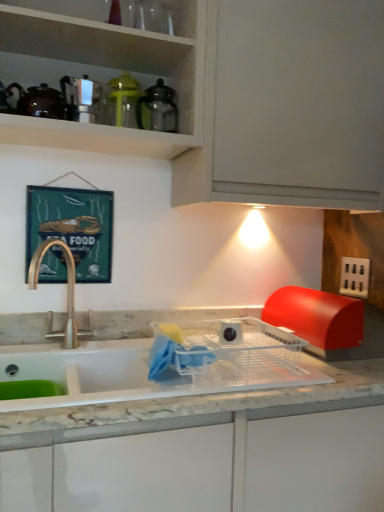
Question: In the image, is satin nickel soap dispenser at upper left, the 1th appliance when ordered from left to right, positioned in front of or behind white glossy sink at center?

Choices:
 (A) behind
 (B) front

Answer: (A)

Question: From the image's perspective, is satin nickel soap dispenser at upper left, the 3th appliance in the right-to-left sequence, located above or below white glossy sink at center?

Choices:
 (A) below
 (B) above

Answer: (B)

Question: Considering the real-world distances, which object is closest to the white glossy sink at center?

Choices:
 (A) translucent yellow pitcher at upper center, the second appliance positioned from the right
 (B) black plastic electric outlet at right
 (C) white matte cabinet at upper center
 (D) satin nickel soap dispenser at upper left, the 3th appliance in the right-to-left sequence
 (E) matte brown teapot at upper left

Answer: (C)

Question: Which object is positioned farthest from the satin nickel soap dispenser at upper left, the 1th appliance when ordered from left to right?

Choices:
 (A) matte brown teapot at upper left
 (B) translucent yellow pitcher at upper center, the second appliance positioned from the right
 (C) white glossy sink at center
 (D) white matte cabinet at upper center
 (E) black plastic electric outlet at right

Answer: (E)